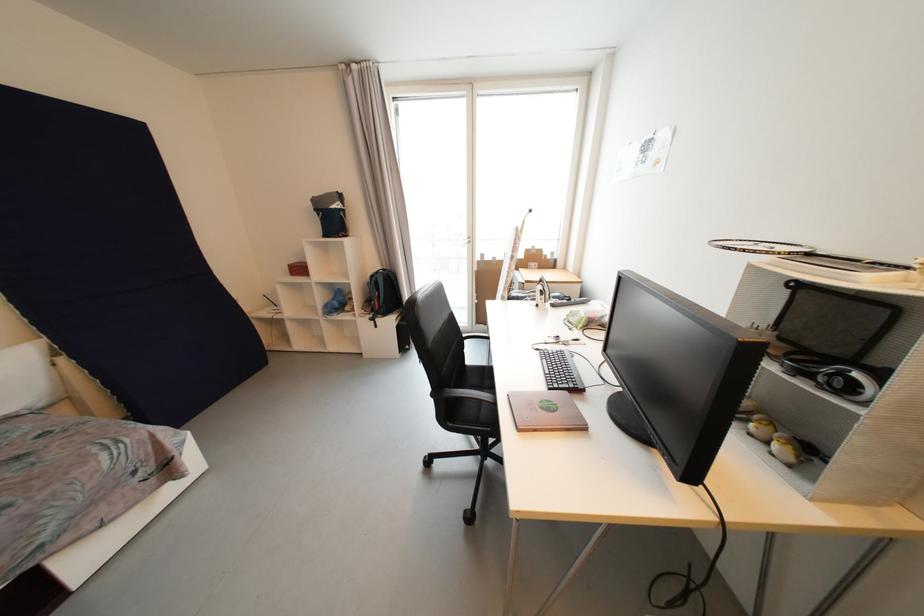
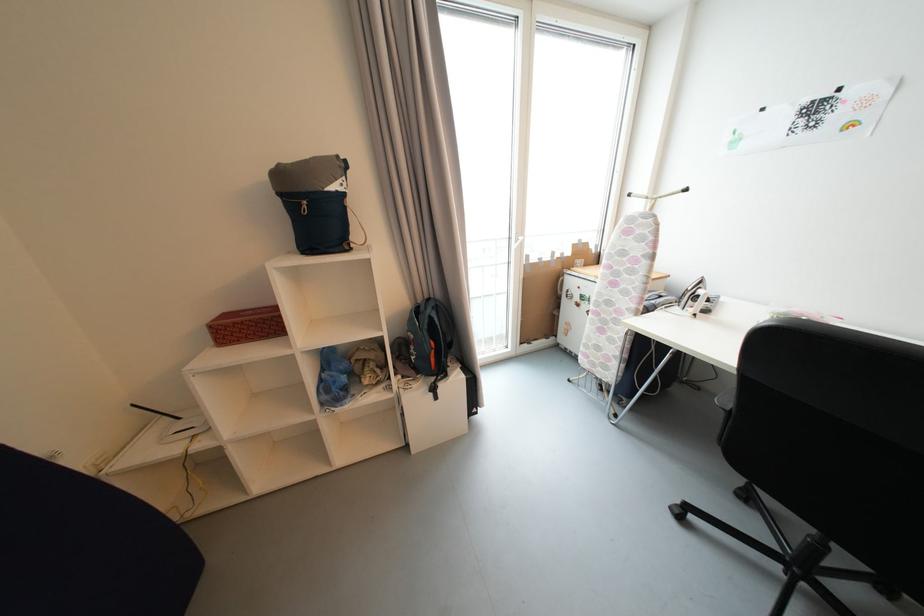
The images are taken continuously from a first-person perspective. In which direction are you moving?

The movement direction of the cameraman is left, forward.